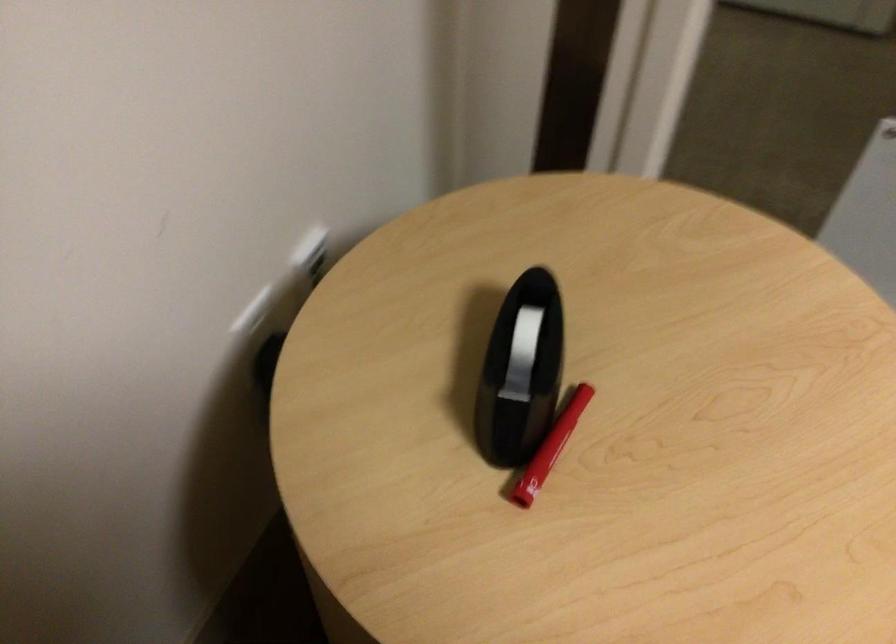
Where would you pull the white tape? Please return your answer as a coordinate pair (x, y).

(521, 354)